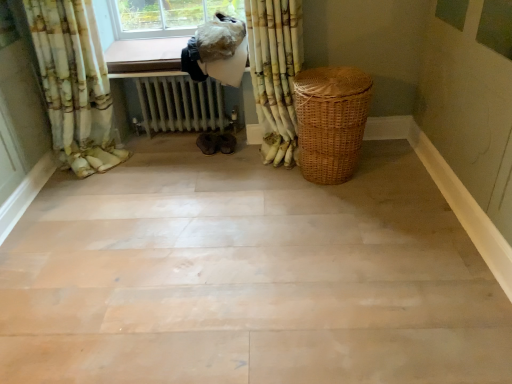
Where is `free point above woven brown basket at right (from a real-world perspective)`? free point above woven brown basket at right (from a real-world perspective) is located at coordinates (329, 80).